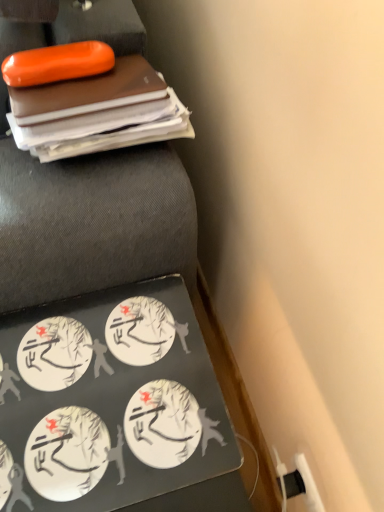
Image resolution: width=384 pixels, height=512 pixels. In order to click on black matte laptop at lower left in this screenshot , I will do (90, 220).

What do you see at coordinates (90, 220) in the screenshot? I see `black matte laptop at lower left` at bounding box center [90, 220].

You are a GUI agent. You are given a task and a screenshot of the screen. Output one action in this format:
    pyautogui.click(x=<x>, y=<y>)
    Task: Click on the white matte stickers at bottom left
    The image size is (384, 512).
    Given the screenshot: What is the action you would take?
    pyautogui.click(x=109, y=402)

Describe the element at coordinates (109, 402) in the screenshot. I see `white matte stickers at bottom left` at that location.

In order to click on black matte laptop at lower left in this screenshot , I will do `click(90, 220)`.

From the picture: Can you confirm if black matte laptop at lower left is positioned to the right of white matte stickers at bottom left?

In fact, black matte laptop at lower left is to the left of white matte stickers at bottom left.

Does black matte laptop at lower left lie behind white matte stickers at bottom left?

No, it is not.

Which is less distant, (x=4, y=136) or (x=90, y=480)?

Point (x=4, y=136) appears to be farther away from the viewer than point (x=90, y=480).

From the image's perspective, is black matte laptop at lower left above or below white matte stickers at bottom left?

Clearly, from the image's perspective, black matte laptop at lower left is above white matte stickers at bottom left.

From a real-world perspective, is black matte laptop at lower left located beneath white matte stickers at bottom left?

No, from a real-world perspective, black matte laptop at lower left is not below white matte stickers at bottom left.

Considering the relative sizes of black matte laptop at lower left and white matte stickers at bottom left in the image provided, is black matte laptop at lower left thinner than white matte stickers at bottom left?

Incorrect, the width of black matte laptop at lower left is not less than that of white matte stickers at bottom left.

Does black matte laptop at lower left have a lesser height compared to white matte stickers at bottom left?

No.

Based on their sizes in the image, would you say black matte laptop at lower left is bigger or smaller than white matte stickers at bottom left?

black matte laptop at lower left is bigger than white matte stickers at bottom left.

Is white matte stickers at bottom left inside black matte laptop at lower left?

No, white matte stickers at bottom left is not inside black matte laptop at lower left.

Based on the photo, is black matte laptop at lower left next to white matte stickers at bottom left and touching it?

No, black matte laptop at lower left is not making contact with white matte stickers at bottom left.

Is black matte laptop at lower left positioned with its back to white matte stickers at bottom left?

black matte laptop at lower left does not have its back to white matte stickers at bottom left.

What's the angular difference between black matte laptop at lower left and white matte stickers at bottom left's facing directions?

The angular difference between black matte laptop at lower left and white matte stickers at bottom left is 0.33 degrees.

How distant is black matte laptop at lower left from white matte stickers at bottom left?

A distance of 6.52 inches exists between black matte laptop at lower left and white matte stickers at bottom left.

What are the coordinates of `food on the right of black matte laptop at lower left` in the screenshot? It's located at click(109, 402).

Considering the relative positions of white matte stickers at bottom left and black matte laptop at lower left in the image provided, is white matte stickers at bottom left to the left or to the right of black matte laptop at lower left?

white matte stickers at bottom left is positioned on black matte laptop at lower left's right side.

Is white matte stickers at bottom left positioned before black matte laptop at lower left?

That is False.

Is point (64, 345) positioned before point (50, 191)?

That is False.

From the picture: From the image's perspective, is white matte stickers at bottom left above black matte laptop at lower left?

No, from the image's perspective, white matte stickers at bottom left is not on top of black matte laptop at lower left.

From a real-world perspective, does white matte stickers at bottom left sit lower than black matte laptop at lower left?

Correct, in the physical world, white matte stickers at bottom left is lower than black matte laptop at lower left.

Considering the sizes of objects white matte stickers at bottom left and black matte laptop at lower left in the image provided, who is wider, white matte stickers at bottom left or black matte laptop at lower left?

With larger width is black matte laptop at lower left.

Is white matte stickers at bottom left taller than black matte laptop at lower left?

In fact, white matte stickers at bottom left may be shorter than black matte laptop at lower left.

Considering the sizes of white matte stickers at bottom left and black matte laptop at lower left in the image, is white matte stickers at bottom left bigger or smaller than black matte laptop at lower left?

Considering their sizes, white matte stickers at bottom left takes up less space than black matte laptop at lower left.

Is white matte stickers at bottom left completely or partially outside of black matte laptop at lower left?

white matte stickers at bottom left lies outside black matte laptop at lower left's area.

Is white matte stickers at bottom left next to black matte laptop at lower left?

No, white matte stickers at bottom left is not making contact with black matte laptop at lower left.

From the picture: Is black matte laptop at lower left at the back of white matte stickers at bottom left?

No, black matte laptop at lower left is not at the back of white matte stickers at bottom left.

What's the angular difference between white matte stickers at bottom left and black matte laptop at lower left's facing directions?

The angle between the facing direction of white matte stickers at bottom left and the facing direction of black matte laptop at lower left is 0.33 degrees.

Locate an element on the screen. This screenshot has width=384, height=512. furniture that is above the white matte stickers at bottom left (from a real-world perspective) is located at coordinates (90, 220).

The image size is (384, 512). Find the location of `food on the right of black matte laptop at lower left`. food on the right of black matte laptop at lower left is located at coordinates (109, 402).

Find the location of a particular element. furniture in front of the white matte stickers at bottom left is located at coordinates (90, 220).